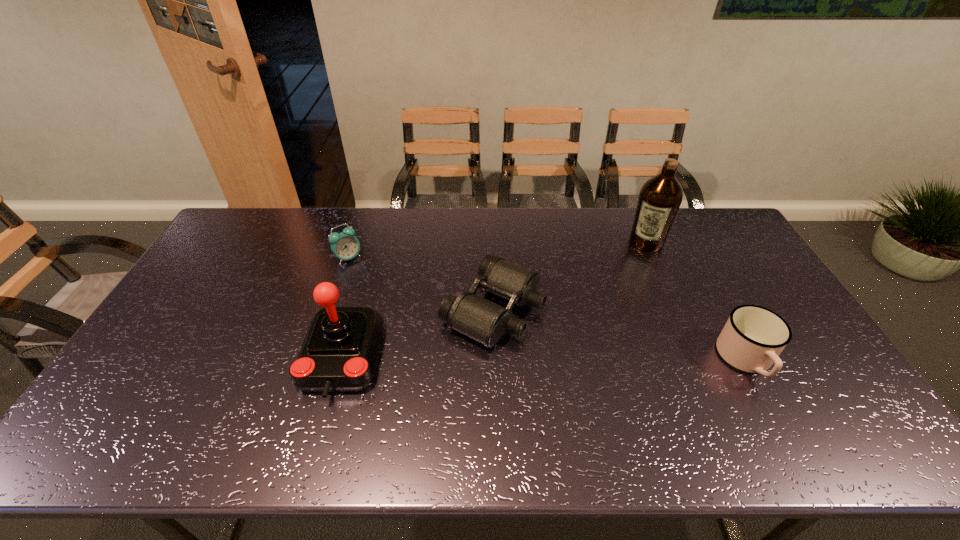
Locate an element on the screen. free point between the mug and the tallest object is located at coordinates (696, 301).

The height and width of the screenshot is (540, 960). I want to click on empty location between the binoculars and the tallest object, so click(x=569, y=275).

Choose which object is the third nearest neighbor to the joystick. Please provide its 2D coordinates. Your answer should be formatted as a tuple, i.e. [(x, y)], where the tuple contains the x and y coordinates of a point satisfying the conditions above.

[(660, 197)]

This screenshot has width=960, height=540. What are the coordinates of `the second closest object relative to the joystick` in the screenshot? It's located at (344, 245).